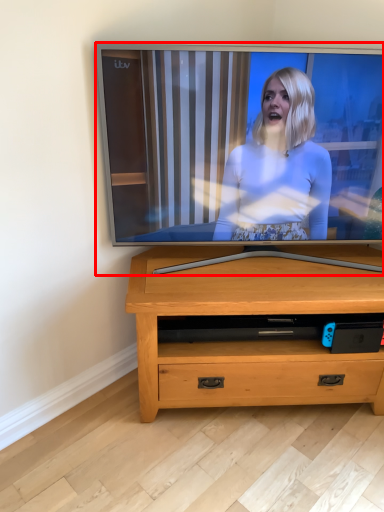
Question: In this image, where is television (annotated by the red box) located relative to chest of drawers?

Choices:
 (A) left
 (B) right

Answer: (A)